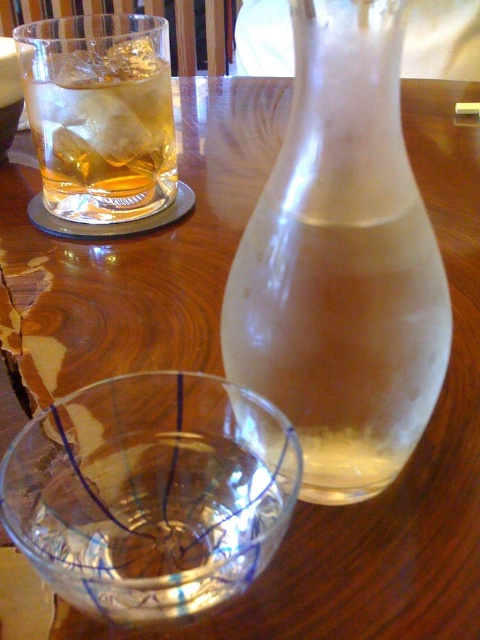
Question: Does transparent glass bowl at center have a greater width compared to amber glass at upper left?

Choices:
 (A) yes
 (B) no

Answer: (B)

Question: Which point is farther from the camera taking this photo?

Choices:
 (A) (108, 128)
 (B) (442, 355)
 (C) (132, 586)

Answer: (A)

Question: Is transparent glass carafe at center further to the viewer compared to amber glass at upper left?

Choices:
 (A) no
 (B) yes

Answer: (A)

Question: Which object is farther from the camera taking this photo?

Choices:
 (A) amber glass at upper left
 (B) transparent glass carafe at center

Answer: (A)

Question: Among these objects, which one is nearest to the camera?

Choices:
 (A) amber glass at upper left
 (B) transparent glass bowl at center

Answer: (B)

Question: Is transparent glass carafe at center thinner than transparent glass bowl at center?

Choices:
 (A) no
 (B) yes

Answer: (B)